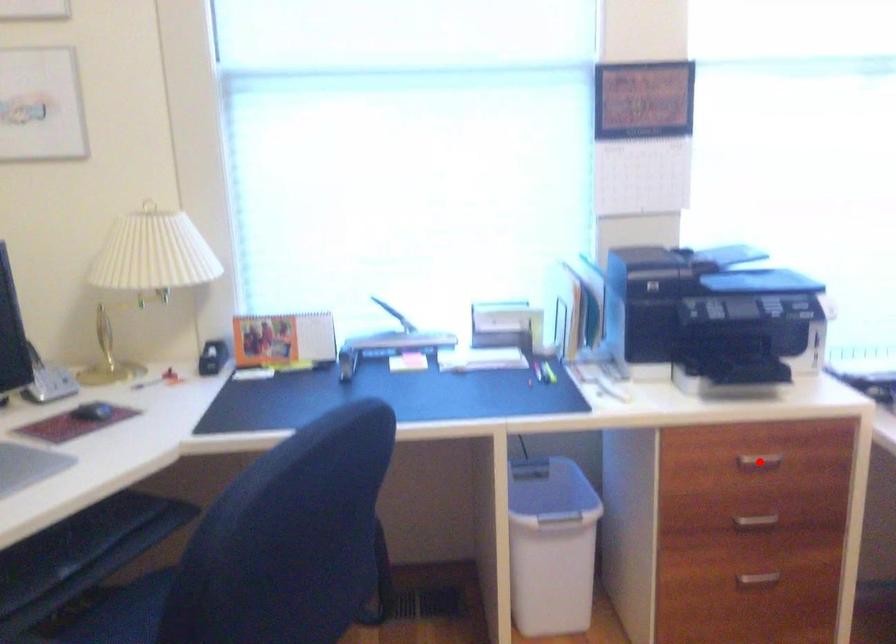
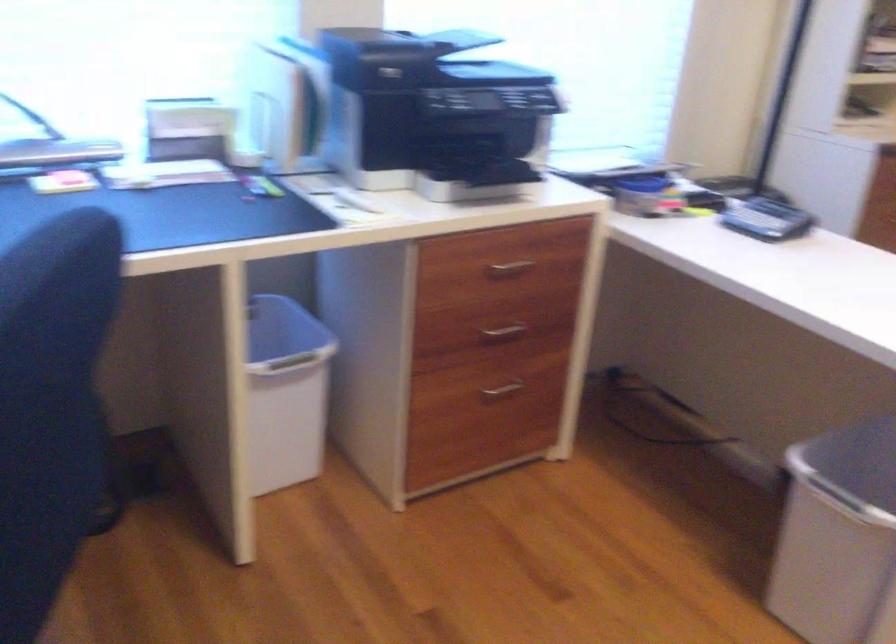
In the second image, find the point that corresponds to the highlighted location in the first image.

(510, 268)